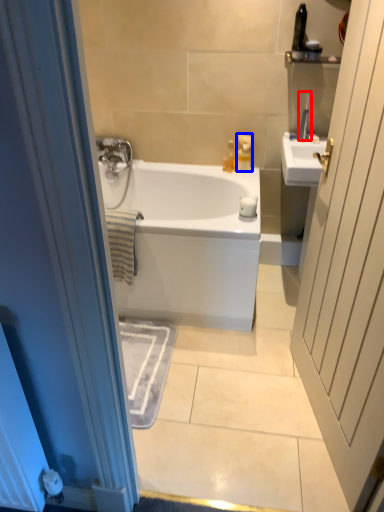
Question: Which of the following is the closest to the observer, toiletry (highlighted by a red box) or toiletry (highlighted by a blue box)?

Choices:
 (A) toiletry
 (B) toiletry

Answer: (A)